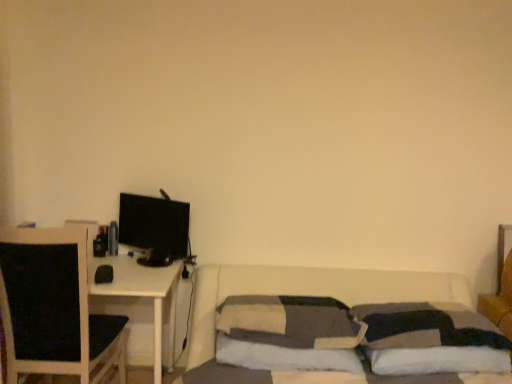
Question: From the image's perspective, is black fabric chair at left positioned above or below white soft pillow at lower right, the third pillow when ordered from left to right?

Choices:
 (A) below
 (B) above

Answer: (B)

Question: From their relative heights in the image, would you say black fabric chair at left is taller or shorter than white soft pillow at lower right, the third pillow when ordered from left to right?

Choices:
 (A) short
 (B) tall

Answer: (B)

Question: Which object is positioned closest to the black fabric chair at left?

Choices:
 (A) white soft pillow at lower right, acting as the 1th pillow starting from the right
 (B) soft gray fabric pillow at center, positioned as the second pillow in left-to-right order
 (C) black glossy monitor at left
 (D) textured gray pillow at center, the 1th pillow in the left-to-right sequence

Answer: (C)

Question: Considering the real-world distances, which object is farthest from the black glossy monitor at left?

Choices:
 (A) soft gray fabric pillow at center, positioned as the second pillow in right-to-left order
 (B) black fabric chair at left
 (C) white soft pillow at lower right, acting as the 1th pillow starting from the right
 (D) textured gray pillow at center, the 1th pillow in the left-to-right sequence

Answer: (C)